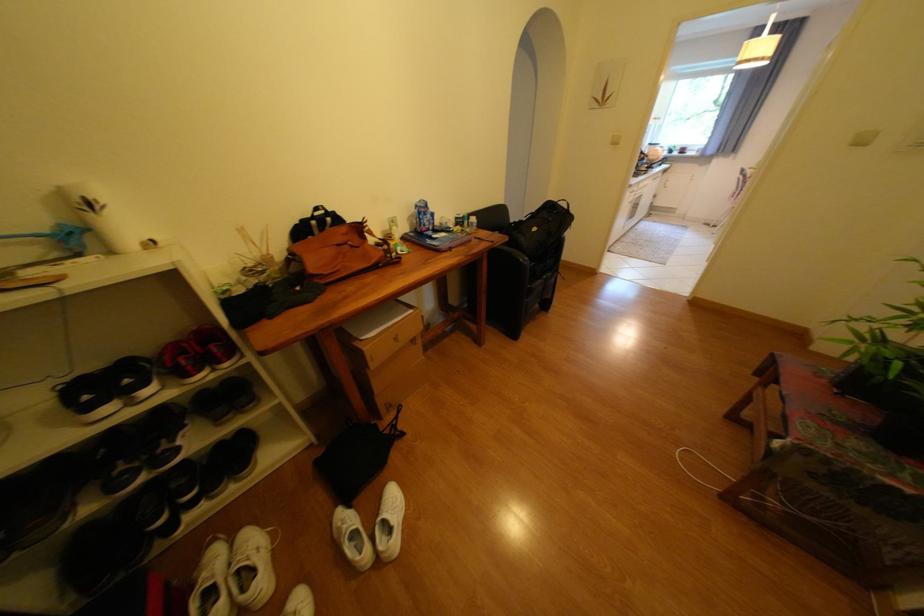
The location [543,228] corresponds to which object?

This point indicates the black backpack.